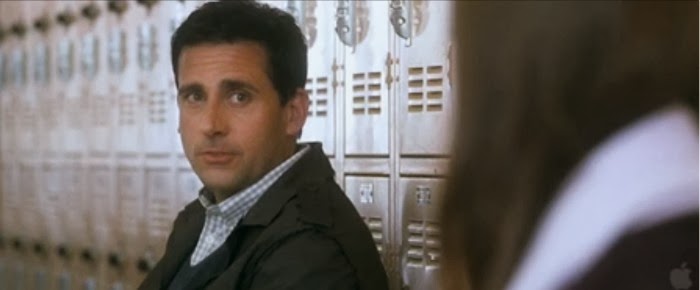
Locate an element on the screen. The width and height of the screenshot is (700, 290). vent hole is located at coordinates (374, 108).